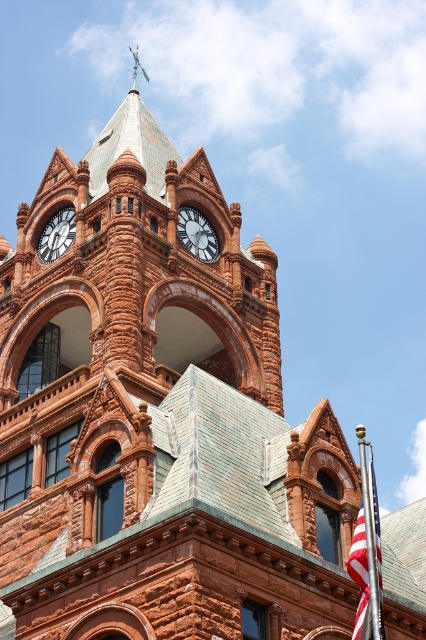
Does matte black clock at center have a lesser height compared to matte brown clock at upper left?

No, matte black clock at center is not shorter than matte brown clock at upper left.

Between point (209, 248) and point (51, 232), which one is positioned behind?

The point (51, 232) is behind.

Identify the location of matte black clock at center. (196, 234).

Who is positioned more to the left, american flag at lower right or matte black clock at center?

matte black clock at center

Between american flag at lower right and matte black clock at center, which one appears on the right side from the viewer's perspective?

american flag at lower right

Identify the location of american flag at lower right. (360, 577).

Which is below, american flag at lower right or matte brown clock at upper left?

american flag at lower right is below.

Is point (363, 592) farther from viewer compared to point (39, 250)?

No, it is in front of (39, 250).

Where is `american flag at lower right`? The height and width of the screenshot is (640, 426). american flag at lower right is located at coordinates (360, 577).